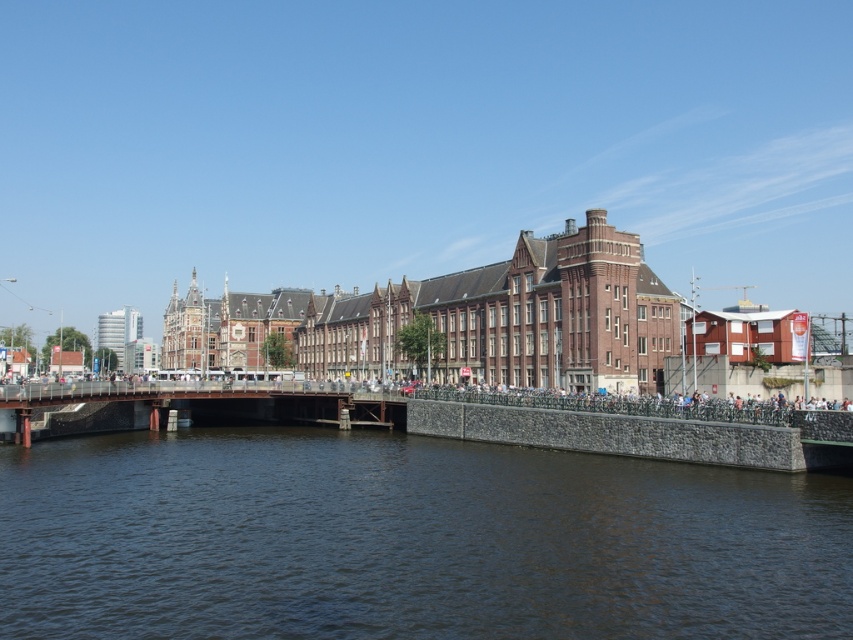
Question: Which point is farther to the camera?

Choices:
 (A) dark brown water at center
 (B) brown metal bridge at center

Answer: (B)

Question: Does dark brown water at center have a greater width compared to brown metal bridge at center?

Choices:
 (A) no
 (B) yes

Answer: (B)

Question: From the image, what is the correct spatial relationship of dark brown water at center in relation to brown metal bridge at center?

Choices:
 (A) below
 (B) above

Answer: (A)

Question: Which point is closer to the camera taking this photo?

Choices:
 (A) (115, 426)
 (B) (102, 563)

Answer: (B)

Question: Can you confirm if dark brown water at center is bigger than brown metal bridge at center?

Choices:
 (A) no
 (B) yes

Answer: (B)

Question: Which of the following is the farthest from the observer?

Choices:
 (A) 341,419
 (B) 160,445

Answer: (A)